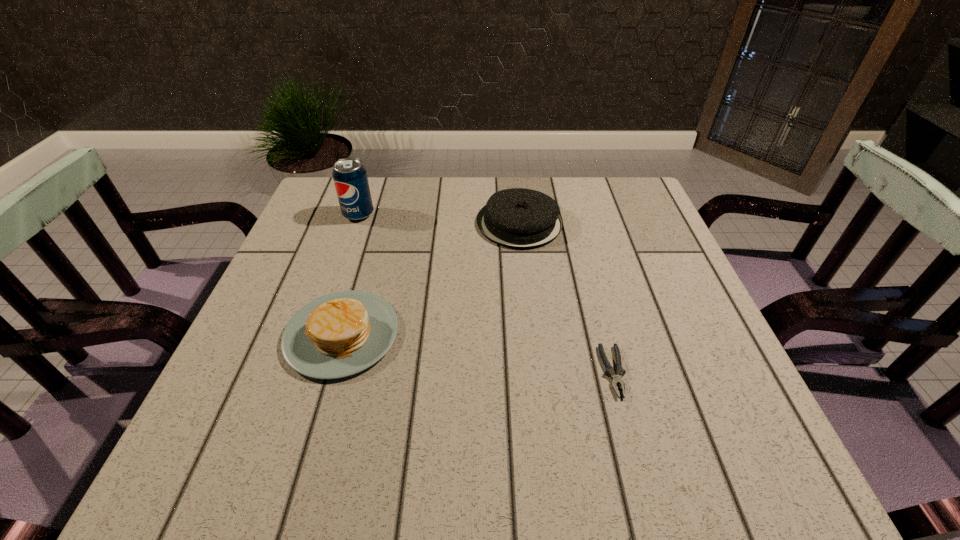
Image resolution: width=960 pixels, height=540 pixels. I want to click on vacant space that's between the pliers and the soda can, so click(486, 293).

Point out which object is positioned as the third nearest to the tallest object. Please provide its 2D coordinates. Your answer should be formatted as a tuple, i.e. [(x, y)], where the tuple contains the x and y coordinates of a point satisfying the conditions above.

[(616, 379)]

Identify the location of the second closest object to the right pancake. The height and width of the screenshot is (540, 960). (350, 178).

Image resolution: width=960 pixels, height=540 pixels. Find the location of `vacant area in the image that satisfies the following two spatial constraints: 1. on the front side of the farther pancake; 2. on the right side of the soda can`. vacant area in the image that satisfies the following two spatial constraints: 1. on the front side of the farther pancake; 2. on the right side of the soda can is located at coordinates (355, 223).